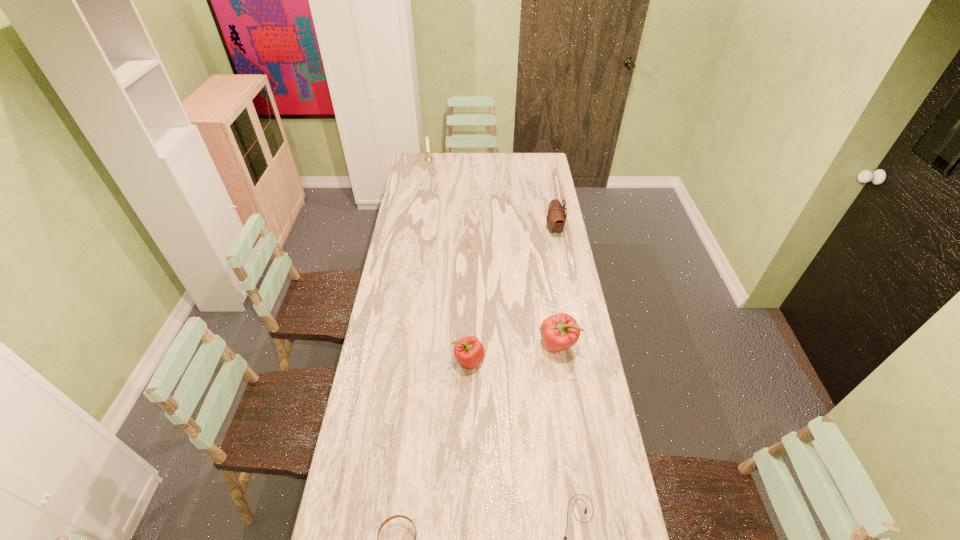
Find the location of a particular element. This screenshot has height=540, width=960. the leftmost object is located at coordinates (428, 159).

Image resolution: width=960 pixels, height=540 pixels. Find the location of `the farthest object`. the farthest object is located at coordinates (428, 159).

Locate an element on the screen. This screenshot has width=960, height=540. the fifth nearest object is located at coordinates [556, 217].

The width and height of the screenshot is (960, 540). I want to click on the taller bell pepper, so click(559, 332).

You are a GUI agent. You are given a task and a screenshot of the screen. Output one action in this format:
    pyautogui.click(x=<x>, y=<y>)
    Task: Click on the third object from left to right
    
    Given the screenshot: What is the action you would take?
    pyautogui.click(x=469, y=351)

I want to click on the fourth tallest object, so click(x=469, y=351).

What are the coordinates of `vacant space located on the right of the farthest object` in the screenshot? It's located at (498, 160).

Image resolution: width=960 pixels, height=540 pixels. I want to click on vacant space located with the flap open on the second farthest object, so click(x=506, y=230).

This screenshot has height=540, width=960. In order to click on vacant space located 0.210m with the flap open on the second farthest object in this screenshot , I will do `click(504, 230)`.

Where is `free region located with the flap open on the second farthest object`? free region located with the flap open on the second farthest object is located at coordinates (480, 230).